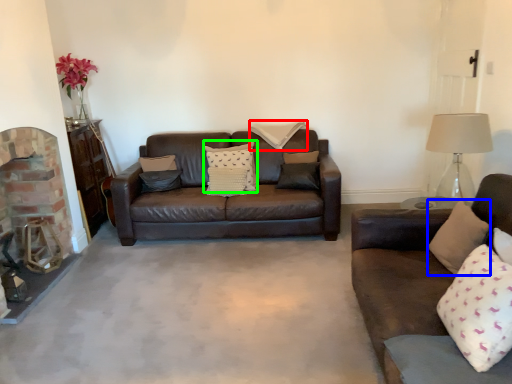
Question: Estimate the real-world distances between objects in this image. Which object is closer to pillow (highlighted by a red box), pillow (highlighted by a blue box) or pillow (highlighted by a green box)?

Choices:
 (A) pillow
 (B) pillow

Answer: (B)